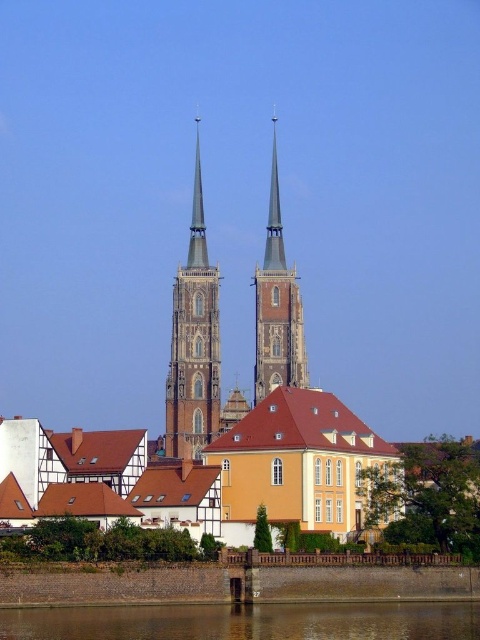
You are standing in the urban landscape and want to find the brown concrete wall at lower center. According to the scene description, where should you look to locate it?

The brown concrete wall at lower center is located at point (247,621), so you should look towards the lower center area of the image to find it.

In the scene shown: You are an architect planning to install a large decorative sculpture. You have two options for placement in the scene described. The first option is near the brown concrete wall at lower center, and the second is near the brown stone spire at center. Which location would allow the sculpture to be more visible to someone standing at the entrance of the scene?

The brown stone spire at center is larger in size than the brown concrete wall at lower center, so placing the sculpture near the brown stone spire at center would make it more visible since it occupies a more prominent position in the scene.